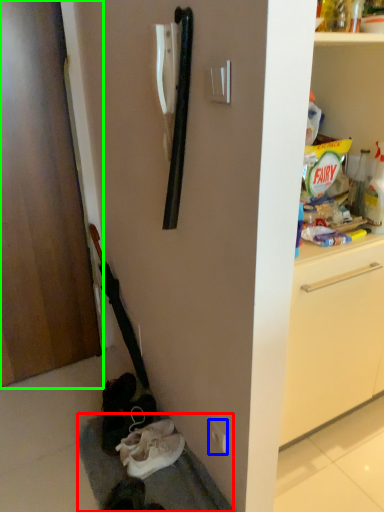
Question: Which is nearer to the gray (highlighted by a red box)? electric outlet (highlighted by a blue box) or door (highlighted by a green box).

Choices:
 (A) electric outlet
 (B) door

Answer: (A)